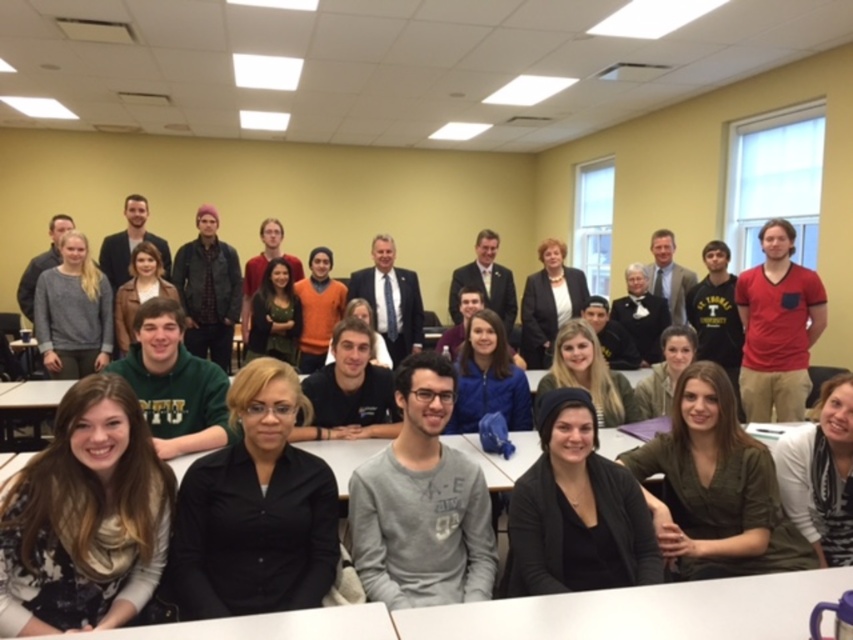
Is black button-up shirt at center smaller than gray sweater at lower left?

Actually, black button-up shirt at center might be larger than gray sweater at lower left.

Measure the distance between black button-up shirt at center and camera.

1.83 meters

Between point (238, 509) and point (88, 280), which one is positioned behind?

The point (88, 280) is more distant.

At what (x,y) coordinates should I click in order to perform the action: click on black button-up shirt at center. Please return your answer as a coordinate pair (x, y). This screenshot has height=640, width=853. Looking at the image, I should click on (254, 509).

Which of these two, red cotton shirt at right or matte black jacket at center, stands shorter?

With less height is matte black jacket at center.

Is red cotton shirt at right bigger than matte black jacket at center?

Yes, red cotton shirt at right is bigger than matte black jacket at center.

Between point (763, 353) and point (126, 195), which one is positioned in front?

Point (763, 353) is more forward.

Where is `red cotton shirt at right`? The image size is (853, 640). red cotton shirt at right is located at coordinates (776, 326).

Is black button-up shirt at center smaller than dark gray suit at center?

Actually, black button-up shirt at center might be larger than dark gray suit at center.

Who is more forward, (309, 412) or (403, 330)?

Positioned in front is point (309, 412).

This screenshot has width=853, height=640. Find the location of `black button-up shirt at center`. black button-up shirt at center is located at coordinates (254, 509).

Where is `black button-up shirt at center`? This screenshot has height=640, width=853. black button-up shirt at center is located at coordinates (254, 509).